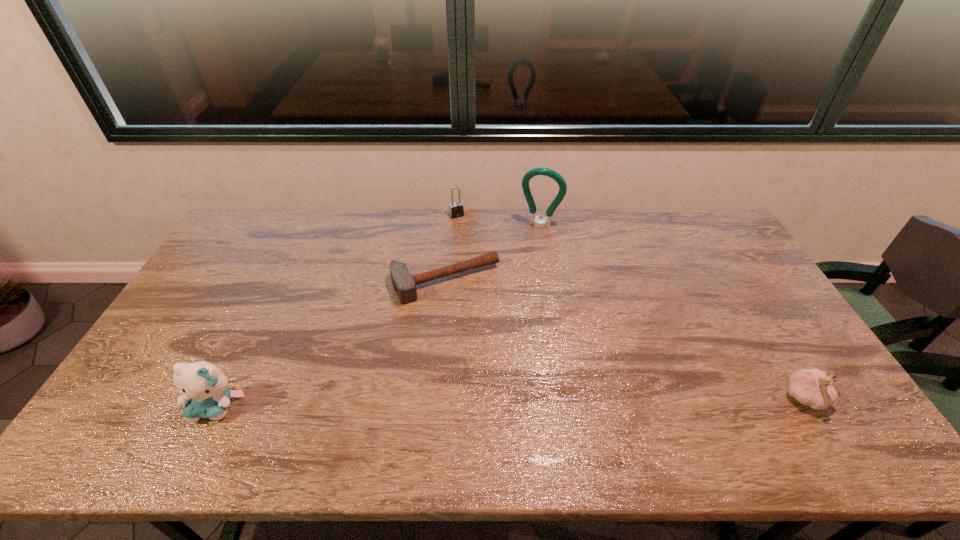
What are the coordinates of `vacant space located 0.370m on the striking surface of the hammer` in the screenshot? It's located at (523, 400).

In order to click on vacant position located on the striking surface of the hammer in this screenshot , I will do `click(489, 340)`.

Where is `free point located 0.260m at the jaws of the second object from right to left`? free point located 0.260m at the jaws of the second object from right to left is located at coordinates (516, 275).

Where is `vacant space situated at the jaws of the second object from right to left`? This screenshot has width=960, height=540. vacant space situated at the jaws of the second object from right to left is located at coordinates (516, 274).

The width and height of the screenshot is (960, 540). Identify the location of free point located at the jaws of the second object from right to left. (521, 262).

You are a GUI agent. You are given a task and a screenshot of the screen. Output one action in this format:
    pyautogui.click(x=<x>, y=<y>)
    Task: Click on the vacant space situated on the shackle of the padlock
    
    Given the screenshot: What is the action you would take?
    pyautogui.click(x=472, y=240)

Locate an element on the screen. The height and width of the screenshot is (540, 960). free location located 0.150m on the shackle of the padlock is located at coordinates (473, 241).

The height and width of the screenshot is (540, 960). I want to click on vacant point located 0.150m on the shackle of the padlock, so click(473, 241).

Locate an element on the screen. The height and width of the screenshot is (540, 960). bottle opener at the far edge is located at coordinates pyautogui.click(x=545, y=222).

This screenshot has width=960, height=540. What are the coordinates of `padlock at the far edge` in the screenshot? It's located at [456, 209].